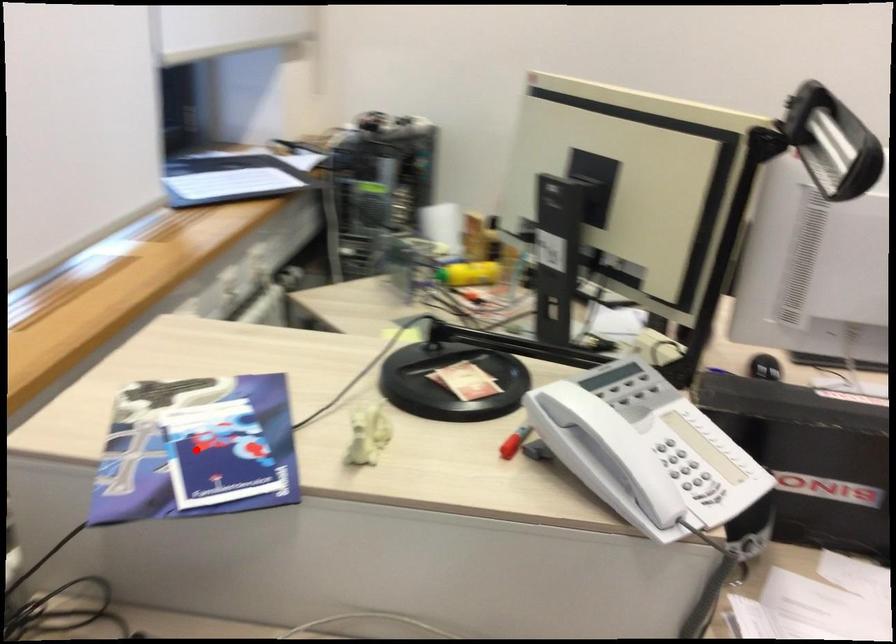
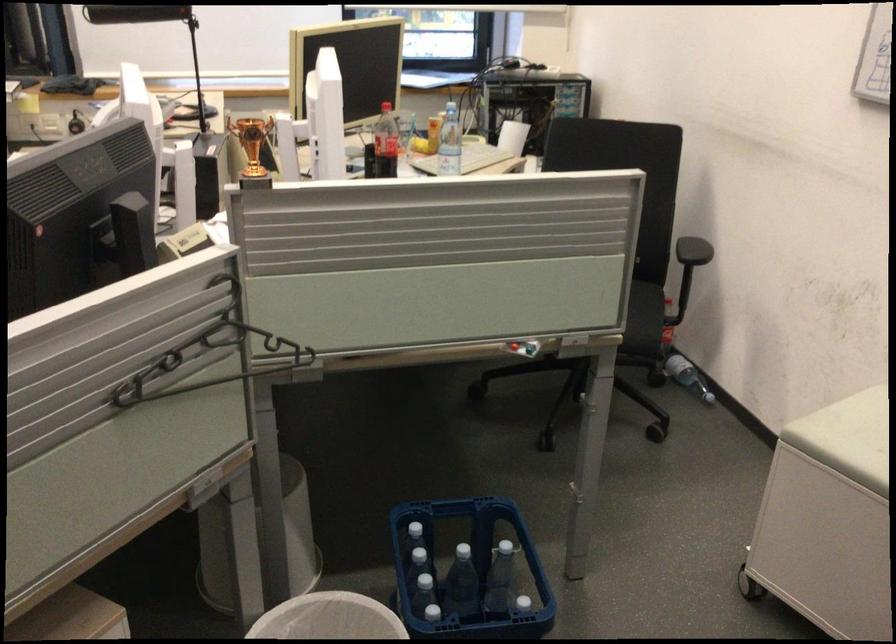
Question: I am providing you with two images of the same scene from different viewpoints. A red point is marked on the first image. Is the red point's position out of view in image 2?

Choices:
 (A) Yes
 (B) No

Answer: (A)